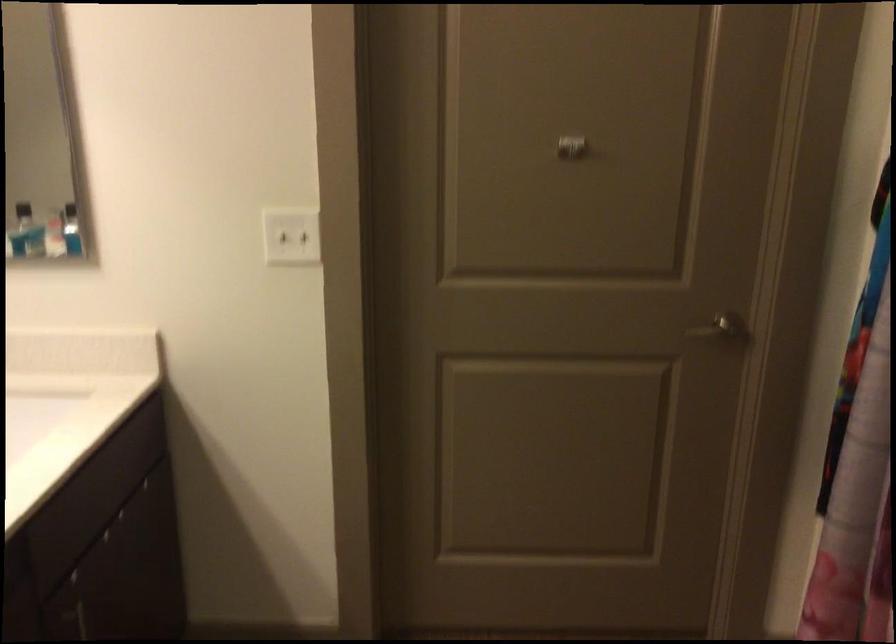
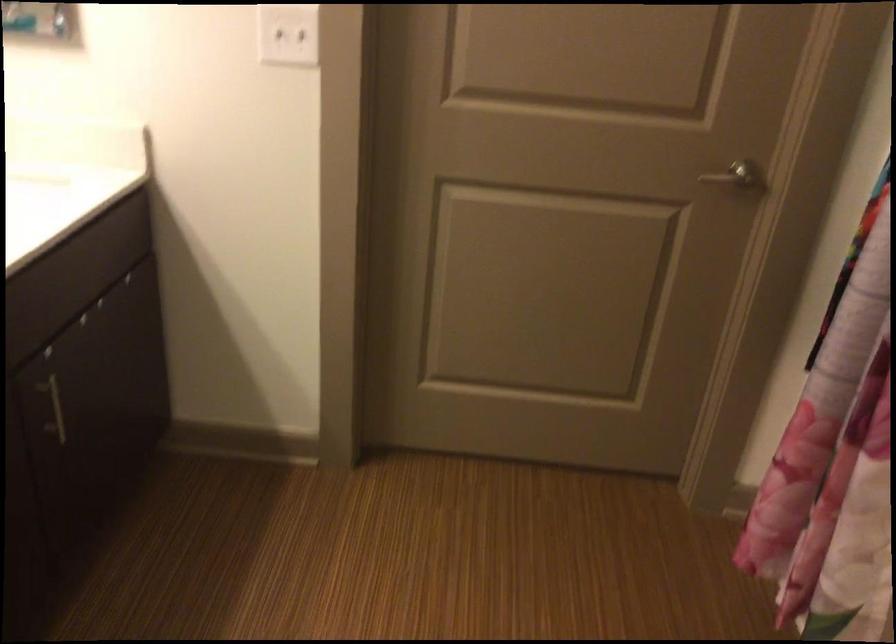
Question: The images are taken continuously from a first-person perspective. In which direction is your viewpoint rotating?

Choices:
 (A) Left
 (B) Right
 (C) Up
 (D) Down

Answer: (D)